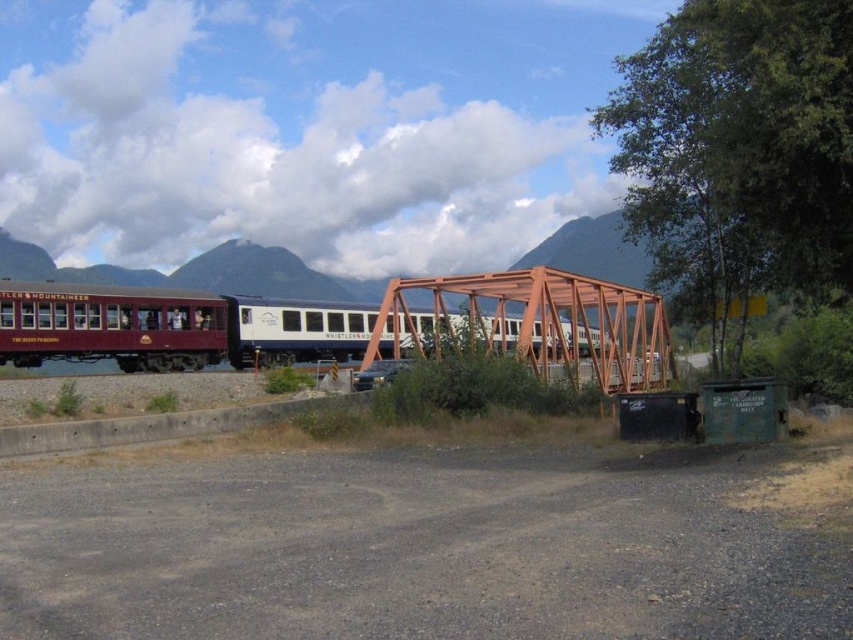
Question: Which object is farther from the camera taking this photo?

Choices:
 (A) maroon polished wood train car at left
 (B) orange metal bridge at center

Answer: (A)

Question: Is maroon polished wood train car at left to the left of orange metal bridge at center from the viewer's perspective?

Choices:
 (A) yes
 (B) no

Answer: (A)

Question: Can you confirm if maroon polished wood train car at left is wider than orange metal bridge at center?

Choices:
 (A) yes
 (B) no

Answer: (A)

Question: Which point is farther to the camera?

Choices:
 (A) orange metal bridge at center
 (B) maroon polished wood train car at left

Answer: (B)

Question: Does maroon polished wood train car at left appear under orange metal bridge at center?

Choices:
 (A) yes
 (B) no

Answer: (B)